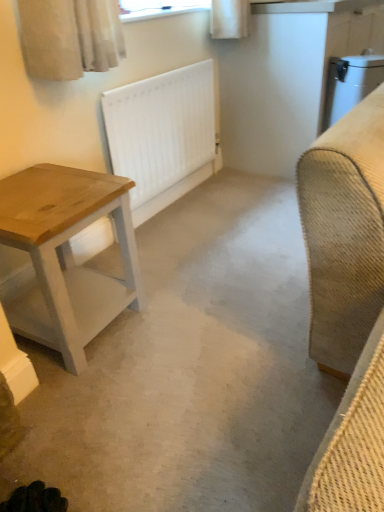
In order to face white matte radiator at center, should I rotate leftwards or rightwards?

You should look left and rotate roughly 3.217 degrees.

Describe the element at coordinates (191, 370) in the screenshot. I see `white matte concrete at center` at that location.

This screenshot has width=384, height=512. I want to click on wooden table at left, so click(67, 255).

From a real-world perspective, who is located lower, wooden table at left or white matte radiator at center?

wooden table at left, from a real-world perspective.

From the image's perspective, is wooden table at left located above or below white matte radiator at center?

wooden table at left is situated lower than white matte radiator at center in the image.

Between wooden table at left and white matte radiator at center, which one has larger width?

Wider between the two is wooden table at left.

Considering the relative positions of wooden table at left and white matte radiator at center in the image provided, is wooden table at left to the right of white matte radiator at center from the viewer's perspective?

No.

Identify the location of concrete beneath the wooden table at left (from a real-world perspective). (191, 370).

Would you say white matte concrete at center is a long distance from wooden table at left?

They are positioned close to each other.

Is white matte concrete at center facing away from wooden table at left?

No, wooden table at left is not at the back of white matte concrete at center.

Is white matte radiator at center directly adjacent to wooden table at left?

No, white matte radiator at center is not beside wooden table at left.

What's the angular difference between white matte radiator at center and wooden table at left's facing directions?

white matte radiator at center and wooden table at left are facing 3.38 degrees away from each other.

Is white matte radiator at center wider or thinner than wooden table at left?

Clearly, white matte radiator at center has less width compared to wooden table at left.

Which object is closer to the camera, white matte radiator at center or wooden table at left?

wooden table at left is more forward.

Is point (22, 201) positioned before point (58, 451)?

That is False.

Is wooden table at left located outside white matte concrete at center?

That's correct, wooden table at left is outside of white matte concrete at center.

Considering the sizes of wooden table at left and white matte concrete at center in the image, is wooden table at left bigger or smaller than white matte concrete at center?

Clearly, wooden table at left is smaller in size than white matte concrete at center.

Is wooden table at left thinner than white matte concrete at center?

Yes.

Considering the sizes of objects white matte concrete at center and white matte radiator at center in the image provided, who is wider, white matte concrete at center or white matte radiator at center?

Wider between the two is white matte concrete at center.

Is white matte radiator at center surrounded by white matte concrete at center?

No, white matte radiator at center is not surrounded by white matte concrete at center.

Does point (166, 260) appear closer or farther from the camera than point (190, 80)?

Clearly, point (166, 260) is closer to the camera than point (190, 80).

Which of these two, white matte radiator at center or white matte concrete at center, is wider?

With larger width is white matte concrete at center.

Is white matte radiator at center to the right of white matte concrete at center from the viewer's perspective?

Incorrect, white matte radiator at center is not on the right side of white matte concrete at center.

Can you confirm if white matte radiator at center is shorter than white matte concrete at center?

Incorrect, the height of white matte radiator at center does not fall short of that of white matte concrete at center.

Where is `radiator located behind the wooden table at left`? The height and width of the screenshot is (512, 384). radiator located behind the wooden table at left is located at coordinates (162, 135).

Where is `concrete below the wooden table at left (from a real-world perspective)`? Image resolution: width=384 pixels, height=512 pixels. concrete below the wooden table at left (from a real-world perspective) is located at coordinates (191, 370).

Which object lies nearer to the anchor point white matte radiator at center, wooden table at left or white matte concrete at center?

white matte concrete at center lies closer to white matte radiator at center than the other object.

Looking at the image, which one is located closer to white matte concrete at center, white matte radiator at center or wooden table at left?

Among the two, wooden table at left is located nearer to white matte concrete at center.

Based on their spatial positions, is white matte concrete at center or wooden table at left closer to white matte radiator at center?

The object closer to white matte radiator at center is white matte concrete at center.

Based on their spatial positions, is white matte radiator at center or white matte concrete at center further from wooden table at left?

white matte radiator at center lies further to wooden table at left than the other object.

Estimate the real-world distances between objects in this image. Which object is further from white matte concrete at center, wooden table at left or white matte radiator at center?

Among the two, white matte radiator at center is located further to white matte concrete at center.

From the image, which object appears to be nearer to wooden table at left, white matte concrete at center or white matte radiator at center?

Among the two, white matte concrete at center is located nearer to wooden table at left.

I want to click on table between white matte concrete at center and white matte radiator at center from front to back, so click(67, 255).